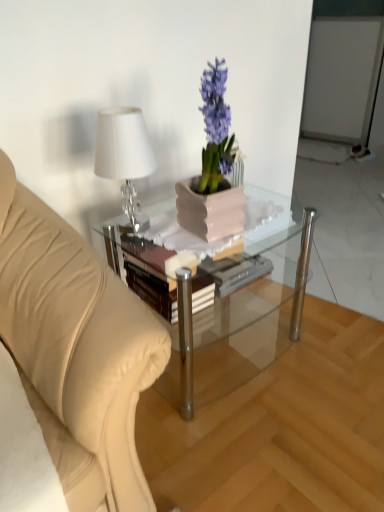
Question: Is matte pink pot at center oriented towards hardcover book at center?

Choices:
 (A) no
 (B) yes

Answer: (A)

Question: Is matte pink pot at center not within hardcover book at center?

Choices:
 (A) yes
 (B) no

Answer: (A)

Question: From the image's perspective, is matte pink pot at center beneath hardcover book at center?

Choices:
 (A) no
 (B) yes

Answer: (A)

Question: Can you confirm if matte pink pot at center is thinner than hardcover book at center?

Choices:
 (A) no
 (B) yes

Answer: (B)

Question: Is matte pink pot at center bigger than hardcover book at center?

Choices:
 (A) no
 (B) yes

Answer: (B)

Question: Is matte pink pot at center wider or thinner than hardcover book at center?

Choices:
 (A) wide
 (B) thin

Answer: (B)

Question: Is matte pink pot at center situated inside hardcover book at center or outside?

Choices:
 (A) inside
 (B) outside

Answer: (B)

Question: From a real-world perspective, relative to hardcover book at center, is matte pink pot at center vertically above or below?

Choices:
 (A) above
 (B) below

Answer: (A)

Question: From their relative heights in the image, would you say matte pink pot at center is taller or shorter than hardcover book at center?

Choices:
 (A) short
 (B) tall

Answer: (B)

Question: From the image's perspective, is shiny silver table lamp at upper left above or below clear glass coffee table at center?

Choices:
 (A) below
 (B) above

Answer: (B)

Question: Based on their positions, is shiny silver table lamp at upper left located to the left or right of clear glass coffee table at center?

Choices:
 (A) right
 (B) left

Answer: (B)

Question: Is shiny silver table lamp at upper left situated inside clear glass coffee table at center or outside?

Choices:
 (A) inside
 (B) outside

Answer: (B)

Question: Looking at the image, does shiny silver table lamp at upper left seem bigger or smaller compared to clear glass coffee table at center?

Choices:
 (A) small
 (B) big

Answer: (A)

Question: In the image, is hardcover book at center positioned in front of or behind clear glass coffee table at center?

Choices:
 (A) behind
 (B) front

Answer: (A)

Question: Do you think hardcover book at center is within clear glass coffee table at center, or outside of it?

Choices:
 (A) outside
 (B) inside

Answer: (B)